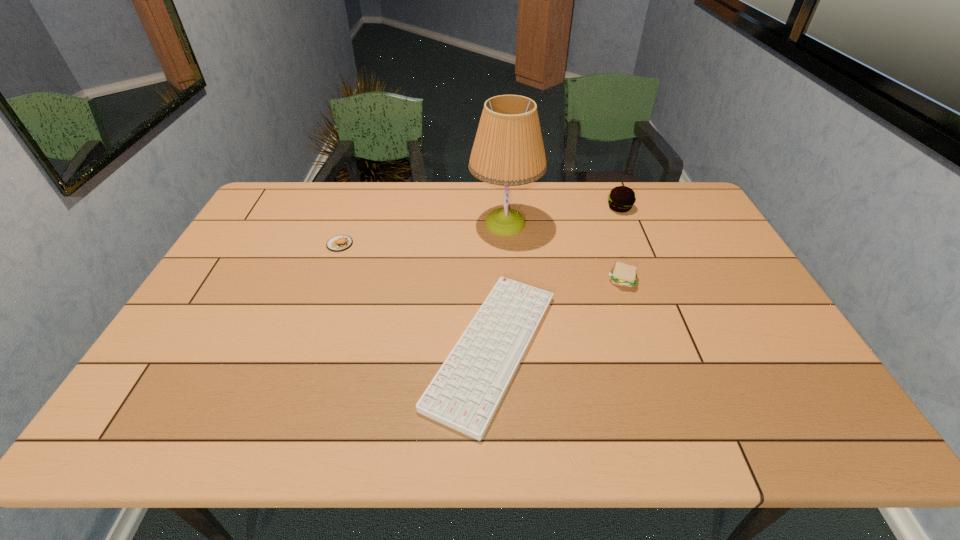
At what (x,y) coordinates should I click in order to perform the action: click on free region at the far left corner of the desktop. Please return your answer as a coordinate pair (x, y). Looking at the image, I should click on (284, 194).

At what (x,y) coordinates should I click in order to perform the action: click on vacant area at the near left corner. Please return your answer as a coordinate pair (x, y). Looking at the image, I should click on (140, 411).

You are a GUI agent. You are given a task and a screenshot of the screen. Output one action in this format:
    pyautogui.click(x=<x>, y=<y>)
    Task: Click on the free space at the far right corner
    The height and width of the screenshot is (540, 960).
    Given the screenshot: What is the action you would take?
    pyautogui.click(x=663, y=204)

You are a GUI agent. You are given a task and a screenshot of the screen. Output one action in this format:
    pyautogui.click(x=<x>, y=<y>)
    Task: Click on the vacant area that lies between the lamp and the nearest patty
    Image resolution: width=960 pixels, height=540 pixels.
    Given the screenshot: What is the action you would take?
    pyautogui.click(x=564, y=252)

The height and width of the screenshot is (540, 960). Find the location of `free area in between the farthest patty and the second nearest patty`. free area in between the farthest patty and the second nearest patty is located at coordinates (480, 226).

You are a GUI agent. You are given a task and a screenshot of the screen. Output one action in this format:
    pyautogui.click(x=<x>, y=<y>)
    Task: Click on the blank region between the second farthest patty and the lamp
    
    Given the screenshot: What is the action you would take?
    pyautogui.click(x=422, y=233)

Locate an element on the screen. This screenshot has height=540, width=960. vacant area that lies between the lamp and the nearest patty is located at coordinates (564, 252).

I want to click on free space between the leftmost object and the nearest patty, so click(481, 262).

You are a GUI agent. You are given a task and a screenshot of the screen. Output one action in this format:
    pyautogui.click(x=<x>, y=<y>)
    Task: Click on the free spot between the tallest object and the nearest patty
    The image size is (960, 540).
    Given the screenshot: What is the action you would take?
    pyautogui.click(x=564, y=252)

Find the location of `vacant space that is in between the second tallest object and the computer keyboard`. vacant space that is in between the second tallest object and the computer keyboard is located at coordinates (556, 278).